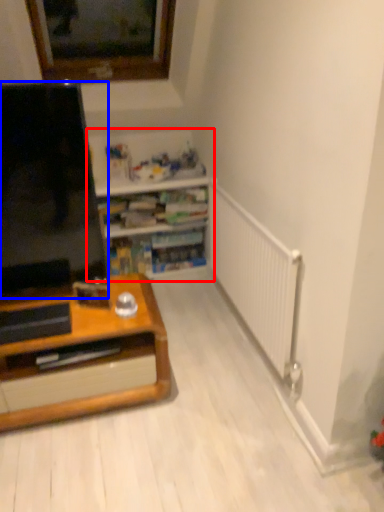
Question: Among these objects, which one is nearest to the camera, shelf (highlighted by a red box) or screen (highlighted by a blue box)?

Choices:
 (A) shelf
 (B) screen

Answer: (B)